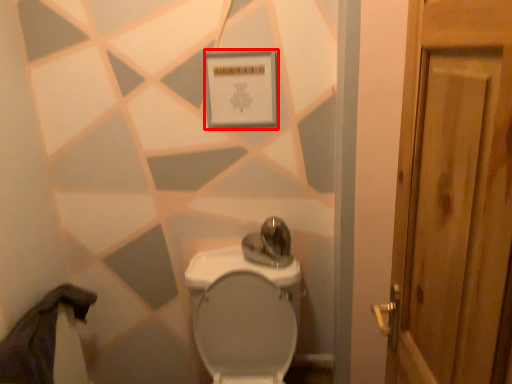
Question: In this image, where is square (annotated by the red box) located relative to toilet?

Choices:
 (A) left
 (B) right

Answer: (A)